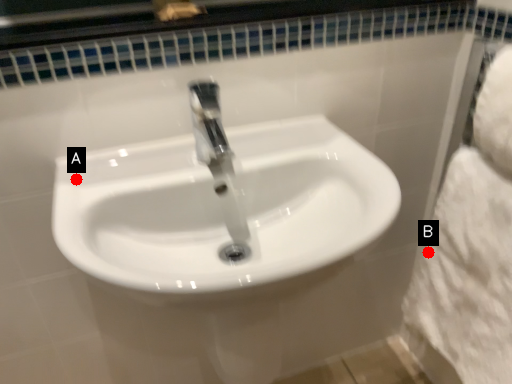
Question: Two points are circled on the image, labeled by A and B beside each circle. Which of the following is the closest to the observer?

Choices:
 (A) A is closer
 (B) B is closer

Answer: (A)